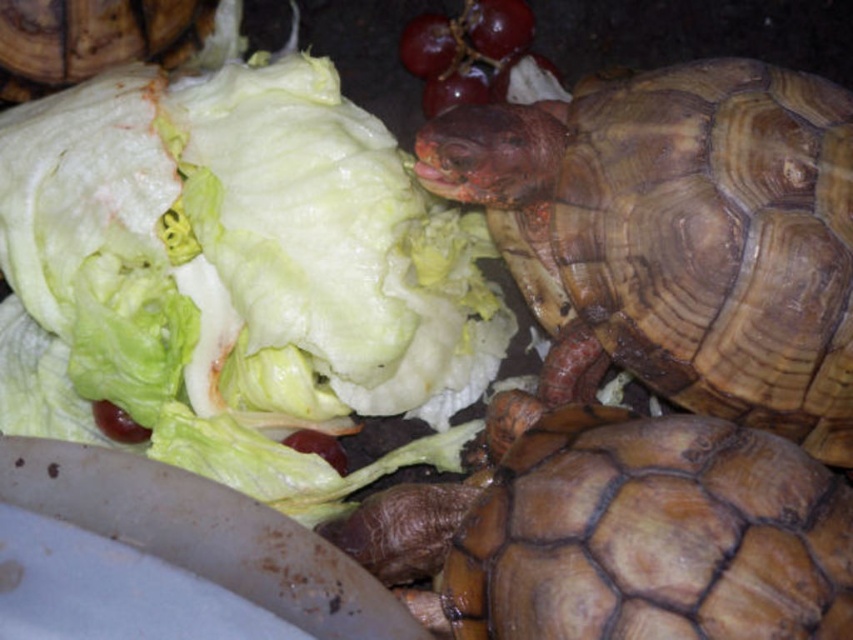
Locate an element on the screen. brown matte shell at upper left is located at coordinates (91, 38).

Who is more forward, (30, 84) or (442, 48)?

Point (30, 84) is in front.

The height and width of the screenshot is (640, 853). Identify the location of brown matte shell at upper left. (91, 38).

Can you confirm if brown leathery tortoise at center is thinner than glossy purple grapes at upper center?

In fact, brown leathery tortoise at center might be wider than glossy purple grapes at upper center.

Measure the distance between brown leathery tortoise at center and camera.

brown leathery tortoise at center and camera are 1.09 meters apart from each other.

Is point (715, 76) positioned after point (515, 20)?

No, it is not.

The width and height of the screenshot is (853, 640). I want to click on brown leathery tortoise at center, so click(677, 236).

Is green leafy lettuce at upper left smaller than glossy purple grapes at upper center?

No, green leafy lettuce at upper left is not smaller than glossy purple grapes at upper center.

Is green leafy lettuce at upper left wider than glossy purple grapes at upper center?

Yes.

Who is more distant from viewer, (132, 333) or (527, 40)?

Point (527, 40)

What are the coordinates of `green leafy lettuce at upper left` in the screenshot? It's located at (238, 273).